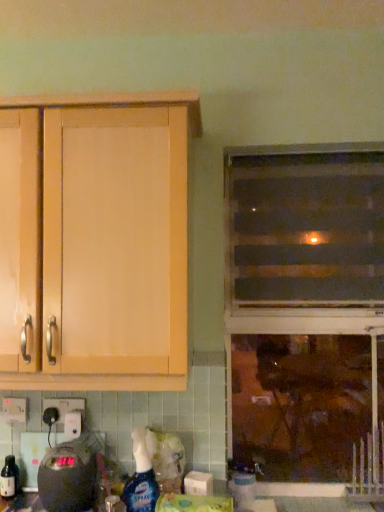
This screenshot has width=384, height=512. In order to click on translucent plastic spray bottle at lower center in this screenshot , I will do `click(142, 474)`.

Where is `light wood cabinet at upper left`? The width and height of the screenshot is (384, 512). light wood cabinet at upper left is located at coordinates (113, 241).

Find the location of a particular element. white plastic electric outlet at lower left is located at coordinates coord(65,408).

In the image, is transparent glass window at center on the left side or the right side of white plastic electric outlet at lower left?

transparent glass window at center is positioned on white plastic electric outlet at lower left's right side.

Is transparent glass window at center oriented away from white plastic electric outlet at lower left?

transparent glass window at center is not turned away from white plastic electric outlet at lower left.

Which object is thinner, transparent glass window at center or white plastic electric outlet at lower left?

white plastic electric outlet at lower left is thinner.

From a real-world perspective, between transparent glass window at center and white plastic electric outlet at lower left, who is vertically higher?

From a 3D spatial view, transparent glass window at center is above.

In terms of width, does translucent plastic screen door at upper right look wider or thinner when compared to light wood cabinet at upper left?

Considering their sizes, translucent plastic screen door at upper right looks slimmer than light wood cabinet at upper left.

Which object is closer to the camera, translucent plastic screen door at upper right or light wood cabinet at upper left?

light wood cabinet at upper left.

Which is correct: translucent plastic screen door at upper right is inside light wood cabinet at upper left, or outside of it?

translucent plastic screen door at upper right is not enclosed by light wood cabinet at upper left.

Consider the image. Could you tell me if translucent plastic screen door at upper right is turned towards light wood cabinet at upper left?

No, translucent plastic screen door at upper right is not oriented towards light wood cabinet at upper left.

Identify the location of cleaning product that appears below the white plastic electric outlet at lower left (from the image's perspective). Image resolution: width=384 pixels, height=512 pixels. (142, 474).

Does white plastic electric outlet at lower left have a greater width compared to translucent plastic spray bottle at lower center?

Incorrect, the width of white plastic electric outlet at lower left does not surpass that of translucent plastic spray bottle at lower center.

Does white plastic electric outlet at lower left touch translucent plastic spray bottle at lower center?

No, white plastic electric outlet at lower left is not beside translucent plastic spray bottle at lower center.

From a real-world perspective, is white plastic electric outlet at lower left under translucent plastic spray bottle at lower center?

Incorrect, from a real-world perspective, white plastic electric outlet at lower left is higher than translucent plastic spray bottle at lower center.

Does transparent glass window at center have a lesser width compared to translucent plastic screen door at upper right?

Yes.

Find the location of a particular element. window that is under the translucent plastic screen door at upper right (from a real-world perspective) is located at coordinates (305, 310).

Which is closer to the camera, (291, 188) or (239, 151)?

Point (291, 188) is farther from the camera than point (239, 151).

From the image's perspective, is transparent glass window at center located above translucent plastic screen door at upper right?

No.

From a real-world perspective, which is physically below, transparent glass window at center or translucent plastic spray bottle at lower center?

translucent plastic spray bottle at lower center.

Where is `cleaning product in front of the transparent glass window at center`? Image resolution: width=384 pixels, height=512 pixels. cleaning product in front of the transparent glass window at center is located at coordinates (142, 474).

Is transparent glass window at center taller or shorter than translucent plastic spray bottle at lower center?

In the image, transparent glass window at center appears to be taller than translucent plastic spray bottle at lower center.

Is transparent glass window at center positioned beyond the bounds of translucent plastic spray bottle at lower center?

transparent glass window at center lies outside translucent plastic spray bottle at lower center's area.

Visually, is translucent plastic screen door at upper right positioned to the left or to the right of white plastic electric outlet at lower left?

In the image, translucent plastic screen door at upper right appears on the right side of white plastic electric outlet at lower left.

From a real-world perspective, which object stands above the other?

From a 3D spatial view, translucent plastic screen door at upper right is above.

Which object is further away from the camera, translucent plastic screen door at upper right or white plastic electric outlet at lower left?

translucent plastic screen door at upper right is more distant.

Is translucent plastic screen door at upper right outside of white plastic electric outlet at lower left?

translucent plastic screen door at upper right lies outside white plastic electric outlet at lower left's area.

Is white plastic electric outlet at lower left shorter than transparent glass window at center?

Indeed, white plastic electric outlet at lower left has a lesser height compared to transparent glass window at center.

Is transparent glass window at center a part of white plastic electric outlet at lower left?

No, transparent glass window at center is not surrounded by white plastic electric outlet at lower left.

Does white plastic electric outlet at lower left come behind transparent glass window at center?

No, white plastic electric outlet at lower left is closer to the viewer.

From the picture: Which object is wider, white plastic electric outlet at lower left or transparent glass window at center?

transparent glass window at center.

Locate an element on the screen. Image resolution: width=384 pixels, height=512 pixels. electric outlet below the transparent glass window at center (from a real-world perspective) is located at coordinates (65, 408).

The width and height of the screenshot is (384, 512). What are the coordinates of `cabinetry lying below the translucent plastic screen door at upper right (from the image's perspective)` in the screenshot? It's located at tap(113, 241).

Looking at the image, which one is located closer to black plastic scale at lower left, transparent glass window at center or matte black spray bottle at lower left?

matte black spray bottle at lower left is positioned closer to the anchor black plastic scale at lower left.

When comparing their distances from black plastic scale at lower left, does matte black spray bottle at lower left or translucent plastic screen door at upper right seem further?

The object further to black plastic scale at lower left is translucent plastic screen door at upper right.

Which object lies further to the anchor point light wood cabinet at upper left, translucent plastic spray bottle at lower center or black plastic scale at lower left?

Based on the image, translucent plastic spray bottle at lower center appears to be further to light wood cabinet at upper left.

Based on their spatial positions, is black plastic scale at lower left or white plastic electric outlet at lower left further from matte black spray bottle at lower left?

white plastic electric outlet at lower left.

From the image, which object appears to be farther from white plastic electric outlet at lower left, transparent glass window at center or matte black spray bottle at lower left?

transparent glass window at center is further to white plastic electric outlet at lower left.

Considering their positions, is matte black spray bottle at lower left positioned further to translucent plastic spray bottle at lower center than light wood cabinet at upper left?

light wood cabinet at upper left is positioned further to the anchor translucent plastic spray bottle at lower center.

From the picture: Estimate the real-world distances between objects in this image. Which object is closer to translucent plastic screen door at upper right, black plastic scale at lower left or transparent glass window at center?

Among the two, transparent glass window at center is located nearer to translucent plastic screen door at upper right.

Based on their spatial positions, is matte black spray bottle at lower left or transparent glass window at center further from light wood cabinet at upper left?

matte black spray bottle at lower left lies further to light wood cabinet at upper left than the other object.

Locate an element on the screen. The height and width of the screenshot is (512, 384). electric outlet that lies between light wood cabinet at upper left and black plastic scale at lower left from top to bottom is located at coordinates (65, 408).

This screenshot has height=512, width=384. I want to click on screen door between black plastic scale at lower left and transparent glass window at center, so click(x=305, y=225).

Where is `electric outlet that lies between light wood cabinet at upper left and matte black spray bottle at lower left from top to bottom`? electric outlet that lies between light wood cabinet at upper left and matte black spray bottle at lower left from top to bottom is located at coordinates (65, 408).

At what (x,y) coordinates should I click in order to perform the action: click on appliance between matte black spray bottle at lower left and translucent plastic screen door at upper right in the horizontal direction. Please return your answer as a coordinate pair (x, y). This screenshot has height=512, width=384. Looking at the image, I should click on (70, 475).